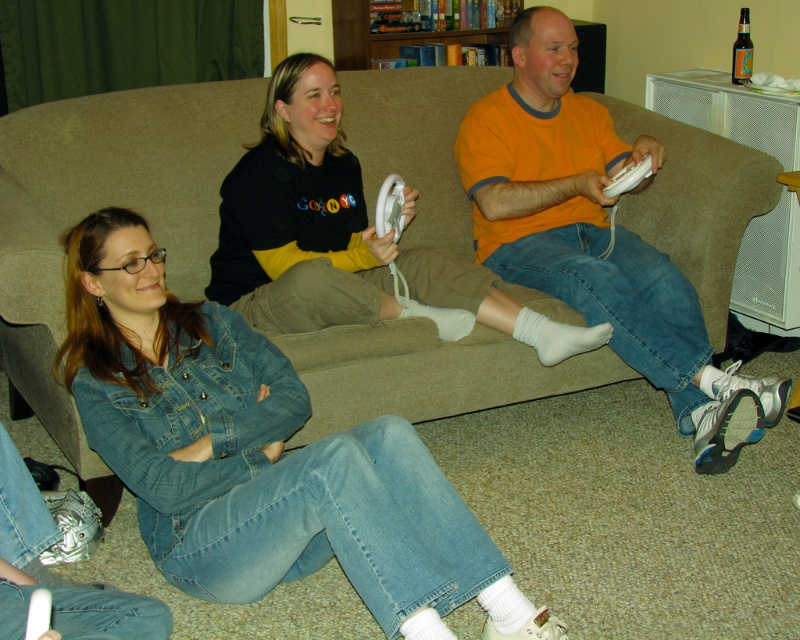
Looking at this image, is the position of denim jacket at lower left more distant than that of black matte sweatshirt at upper center?

No, denim jacket at lower left is closer to the viewer.

Consider the image. Between denim jacket at lower left and black matte sweatshirt at upper center, which one has less height?

With less height is black matte sweatshirt at upper center.

Locate an element on the screen. The width and height of the screenshot is (800, 640). denim jacket at lower left is located at coordinates (260, 456).

Can you confirm if orange cotton shirt at center is bigger than black matte sweatshirt at upper center?

Indeed, orange cotton shirt at center has a larger size compared to black matte sweatshirt at upper center.

Can you confirm if orange cotton shirt at center is smaller than black matte sweatshirt at upper center?

No.

Find the location of `orange cotton shirt at center`. orange cotton shirt at center is located at coordinates (596, 236).

Based on the photo, is white plastic remote at center bigger than white matte controller at center right?

Correct, white plastic remote at center is larger in size than white matte controller at center right.

The width and height of the screenshot is (800, 640). What do you see at coordinates (389, 205) in the screenshot? I see `white plastic remote at center` at bounding box center [389, 205].

Is point (400, 186) in front of point (648, 164)?

Yes.

I want to click on white plastic remote at center, so click(x=389, y=205).